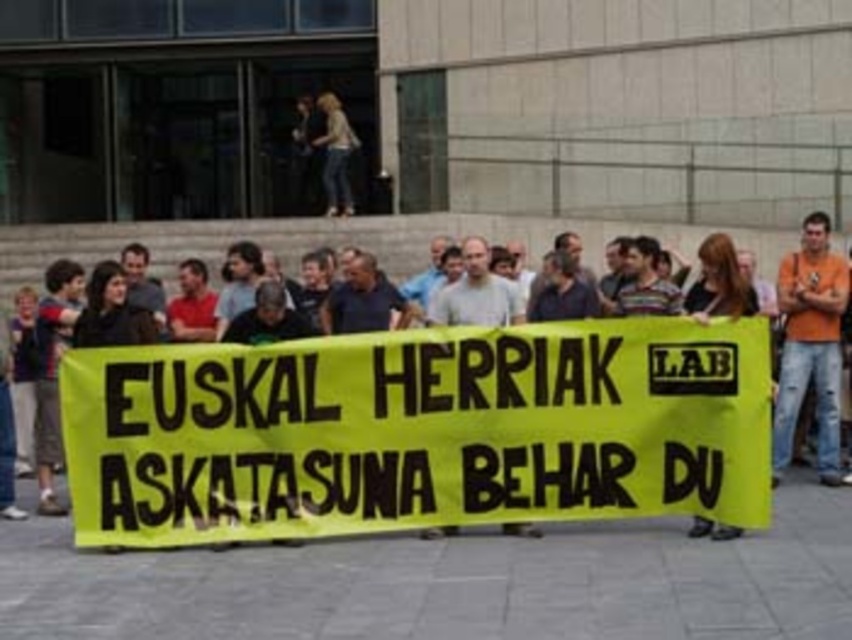
Is yellow fabric banner at center below matte black shirt at center?

Actually, yellow fabric banner at center is above matte black shirt at center.

Between point (130, 253) and point (447, 528), which one is positioned behind?

The point (130, 253) is behind.

I want to click on yellow fabric banner at center, so click(x=222, y=240).

Is point (801, 278) positioned after point (482, 292)?

Yes, it is.

Is point (787, 394) more distant than point (430, 316)?

Yes.

Identify the location of orange cotton shirt at right. (810, 346).

Can you confirm if yellow fabric banner at center is positioned to the left of orange cotton shirt at right?

Correct, you'll find yellow fabric banner at center to the left of orange cotton shirt at right.

The width and height of the screenshot is (852, 640). What do you see at coordinates (222, 240) in the screenshot?
I see `yellow fabric banner at center` at bounding box center [222, 240].

Is point (387, 250) closer to viewer compared to point (825, 346)?

No, it is behind (825, 346).

You are a GUI agent. You are given a task and a screenshot of the screen. Output one action in this format:
    pyautogui.click(x=<x>, y=<y>)
    Task: Click on the yellow fabric banner at center
    
    Given the screenshot: What is the action you would take?
    pyautogui.click(x=222, y=240)